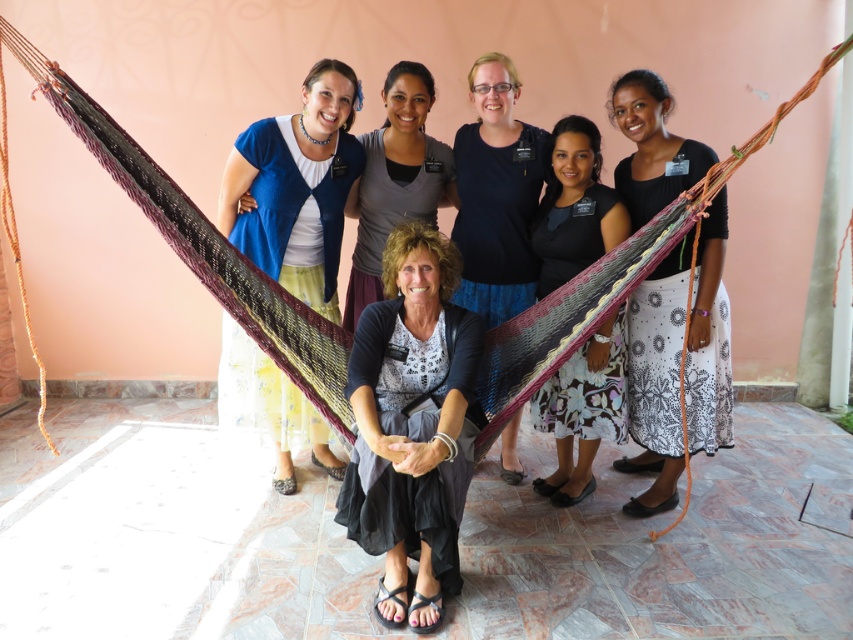
Question: Is matte blue cardigan at upper left above printed cotton skirt at right?

Choices:
 (A) no
 (B) yes

Answer: (B)

Question: Is matte blue cardigan at upper left to the left of floral skirt at center from the viewer's perspective?

Choices:
 (A) no
 (B) yes

Answer: (B)

Question: Based on their relative distances, which object is nearer to the matte black shirt at center?

Choices:
 (A) floral skirt at center
 (B) matte blue cardigan at upper left
 (C) printed cotton skirt at right

Answer: (C)

Question: Is multicolored woven hammock at center smaller than matte blue cardigan at upper left?

Choices:
 (A) no
 (B) yes

Answer: (A)

Question: Which of the following is the farthest from the observer?

Choices:
 (A) matte black shirt at center
 (B) floral skirt at center
 (C) printed cotton skirt at right

Answer: (A)

Question: Which point appears farthest from the camera in this image?

Choices:
 (A) (660, 317)
 (B) (173, 250)
 (C) (236, 352)

Answer: (C)